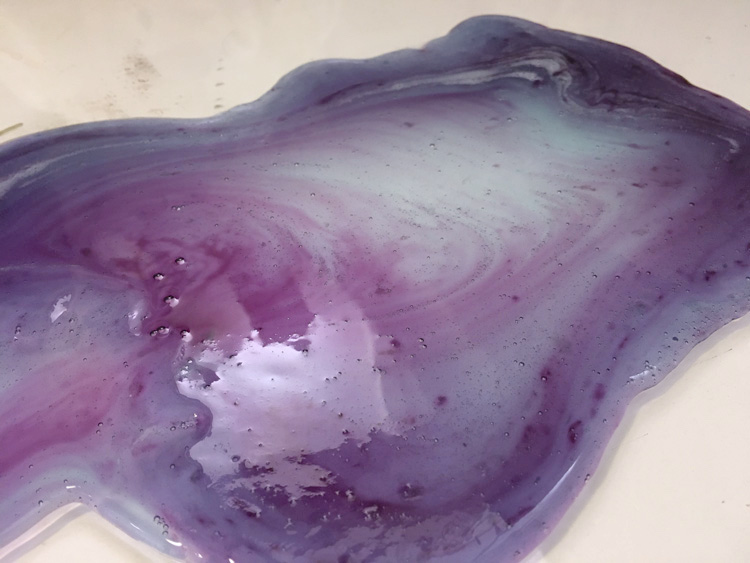
Locate an element on the screen. porcelain countertop or furface is located at coordinates (658, 522).